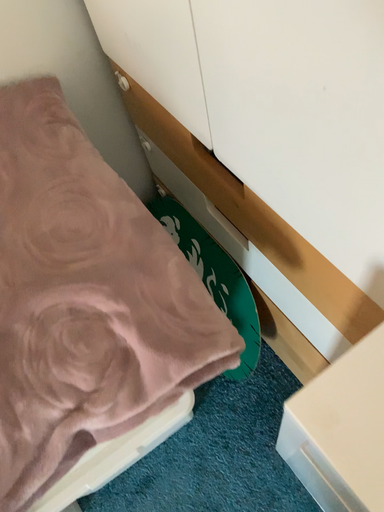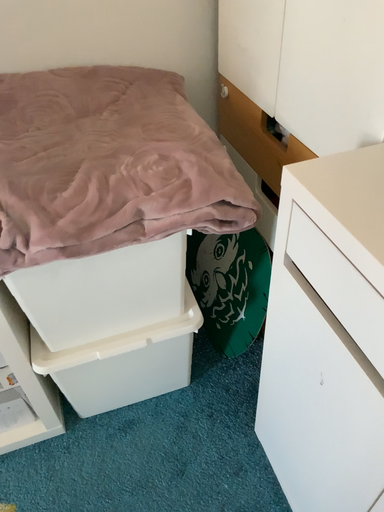
Question: How did the camera likely rotate when shooting the video?

Choices:
 (A) rotated upward
 (B) rotated downward

Answer: (A)